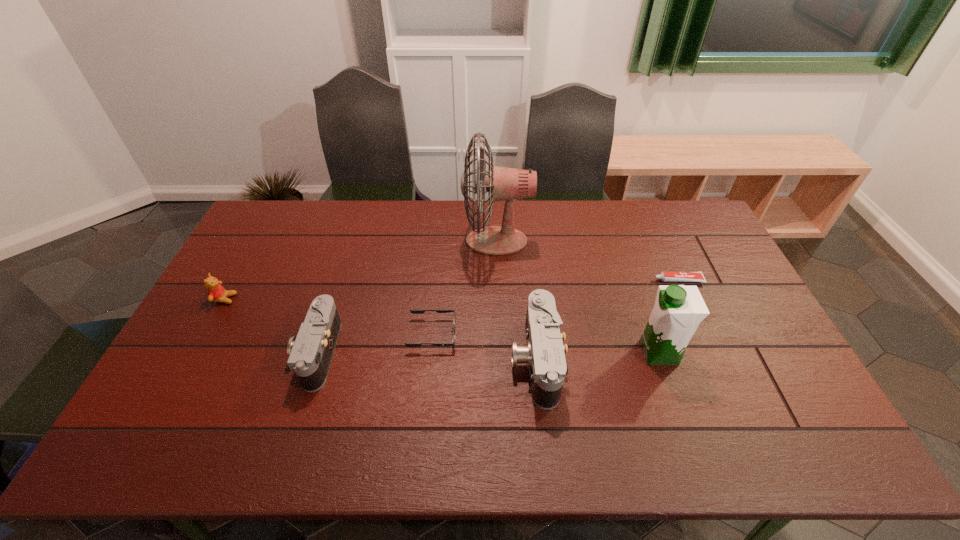
I want to click on free space located 0.280m in front of the tallest object to direct airflow, so click(384, 241).

Where is `blank space located in front of the tallest object to direct airflow`? This screenshot has width=960, height=540. blank space located in front of the tallest object to direct airflow is located at coordinates (418, 241).

Where is `vacant space located 0.080m in front of the tallest object to direct airflow`? This screenshot has width=960, height=540. vacant space located 0.080m in front of the tallest object to direct airflow is located at coordinates (440, 241).

At what (x,y) coordinates should I click in order to perform the action: click on vacant space situated on the front-facing side of the third shortest object. Please return your answer as a coordinate pair (x, y). The width and height of the screenshot is (960, 540). Looking at the image, I should click on (274, 299).

Locate an element on the screen. free space located 0.070m on the temples of the fifth object from right to left is located at coordinates (481, 334).

Find the location of a particular element. Image resolution: width=960 pixels, height=540 pixels. vacant region located at the nozzle of the shortest object is located at coordinates (540, 280).

This screenshot has width=960, height=540. In order to click on free location located 0.160m at the nozzle of the shortest object in this screenshot , I will do `click(604, 280)`.

You are a GUI agent. You are given a task and a screenshot of the screen. Output one action in this format:
    pyautogui.click(x=<x>, y=<y>)
    Task: Click on the free space located 0.140m at the nozzle of the shortest object
    This screenshot has width=960, height=540.
    Given the screenshot: What is the action you would take?
    pyautogui.click(x=611, y=280)

I want to click on vacant space located 0.140m on the front-facing side of the sixth object from left to right, so click(x=588, y=353).

Where is `free space located 0.100m on the front-facing side of the sixth object from left to right`? The image size is (960, 540). free space located 0.100m on the front-facing side of the sixth object from left to right is located at coordinates (603, 353).